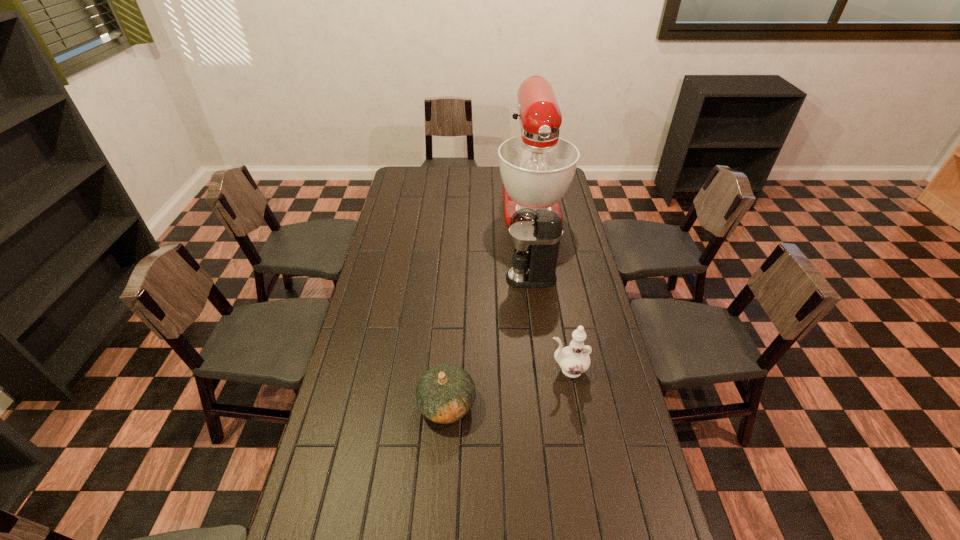
Image resolution: width=960 pixels, height=540 pixels. I want to click on the farthest object, so click(x=537, y=168).

The image size is (960, 540). What are the coordinates of `mixer` in the screenshot? It's located at (537, 168).

Locate an element on the screen. Image resolution: width=960 pixels, height=540 pixels. the third nearest object is located at coordinates (535, 234).

Image resolution: width=960 pixels, height=540 pixels. I want to click on the third shortest object, so click(x=535, y=234).

Find the location of a particular element. The width and height of the screenshot is (960, 540). the third tallest object is located at coordinates click(574, 360).

You are a GUI agent. You are given a task and a screenshot of the screen. Output one action in this format:
    pyautogui.click(x=<x>, y=<y>)
    Task: Click on the shortest object
    
    Given the screenshot: What is the action you would take?
    pyautogui.click(x=445, y=393)

Where is `gourd`? gourd is located at coordinates (445, 393).

Where is `vacant space located 0.390m at the attachment hub of the farthest object`? The image size is (960, 540). vacant space located 0.390m at the attachment hub of the farthest object is located at coordinates (546, 298).

At what (x,y) coordinates should I click in order to perform the action: click on vacant space located place cup under the spout of the third shortest object. Please return your answer as a coordinate pair (x, y). The image size is (960, 540). Looking at the image, I should click on (493, 278).

I want to click on vacant area located place cup under the spout of the third shortest object, so click(x=493, y=278).